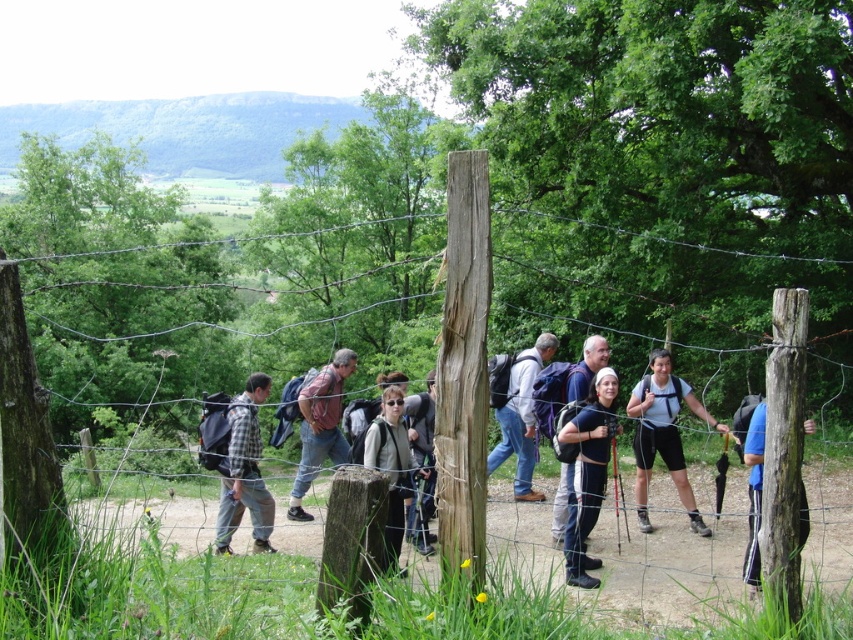
Based on the photo, is wooden post at center shorter than dark gray backpack at center?

Incorrect, wooden post at center's height does not fall short of dark gray backpack at center's.

Does wooden post at center have a smaller size compared to dark gray backpack at center?

Yes, wooden post at center is smaller than dark gray backpack at center.

At what (x,y) coordinates should I click in order to perform the action: click on wooden post at center. Please return your answer as a coordinate pair (x, y). The image size is (853, 640). Looking at the image, I should click on (463, 372).

From the picture: Can you confirm if wire mesh fence at center is positioned to the left of rustic brown backpack at center?

No, wire mesh fence at center is not to the left of rustic brown backpack at center.

Can you confirm if wire mesh fence at center is thinner than rustic brown backpack at center?

In fact, wire mesh fence at center might be wider than rustic brown backpack at center.

The height and width of the screenshot is (640, 853). What do you see at coordinates (354, 531) in the screenshot?
I see `wire mesh fence at center` at bounding box center [354, 531].

The height and width of the screenshot is (640, 853). I want to click on wire mesh fence at center, so click(x=354, y=531).

Does plaid fabric shirt at center have a smaller size compared to blue fabric backpack at right?

Yes, plaid fabric shirt at center is smaller than blue fabric backpack at right.

Which of these two, plaid fabric shirt at center or blue fabric backpack at right, stands taller?

Standing taller between the two is plaid fabric shirt at center.

Which is in front, point (234, 512) or point (761, 474)?

Positioned in front is point (761, 474).

Find the location of `plaid fabric shirt at center`. plaid fabric shirt at center is located at coordinates (245, 472).